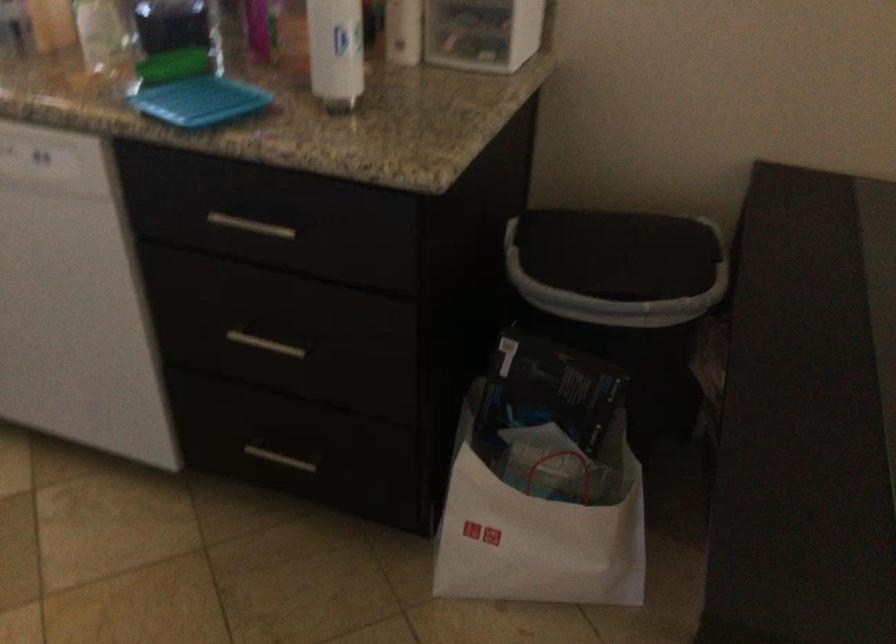
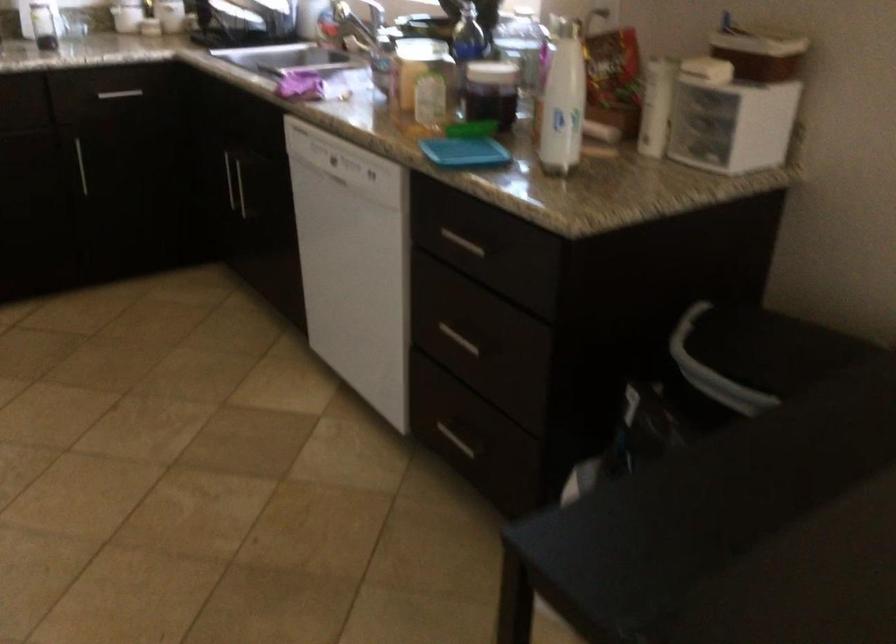
Locate, in the second image, the point that corresponds to pixel 238 225 in the first image.

(462, 243)